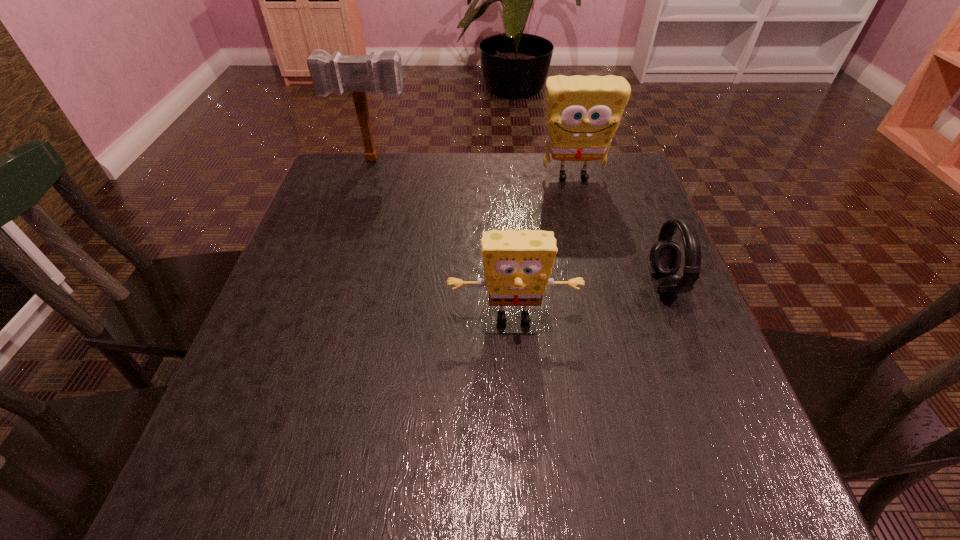
The height and width of the screenshot is (540, 960). I want to click on vacant region located 0.170m on the face of the second shortest object, so click(x=520, y=423).

Where is `free space located 0.220m on the earcups of the headset`? free space located 0.220m on the earcups of the headset is located at coordinates (544, 283).

Locate an element on the screen. free space located on the earcups of the headset is located at coordinates (603, 283).

You are a GUI agent. You are given a task and a screenshot of the screen. Output one action in this format:
    pyautogui.click(x=<x>, y=<y>)
    Task: Click on the free space located 0.240m on the earcups of the headset
    The width and height of the screenshot is (960, 540).
    Given the screenshot: What is the action you would take?
    pyautogui.click(x=535, y=283)

Find the location of `mallet situated at the far edge`. mallet situated at the far edge is located at coordinates (358, 74).

You are a GUI agent. You are given a task and a screenshot of the screen. Output one action in this format:
    pyautogui.click(x=<x>, y=<y>)
    Task: Click on the sponge that is positioned at the far edge
    The height and width of the screenshot is (540, 960).
    Given the screenshot: What is the action you would take?
    pyautogui.click(x=583, y=113)

The width and height of the screenshot is (960, 540). I want to click on object that is at the left edge, so click(358, 74).

The image size is (960, 540). I want to click on sponge that is positioned at the right edge, so click(x=583, y=113).

At what (x,y) coordinates should I click in order to perform the action: click on headset at the right edge. Please return your answer as a coordinate pair (x, y). Image resolution: width=960 pixels, height=540 pixels. Looking at the image, I should click on (665, 255).

Identify the location of object that is at the far left corner. (358, 74).